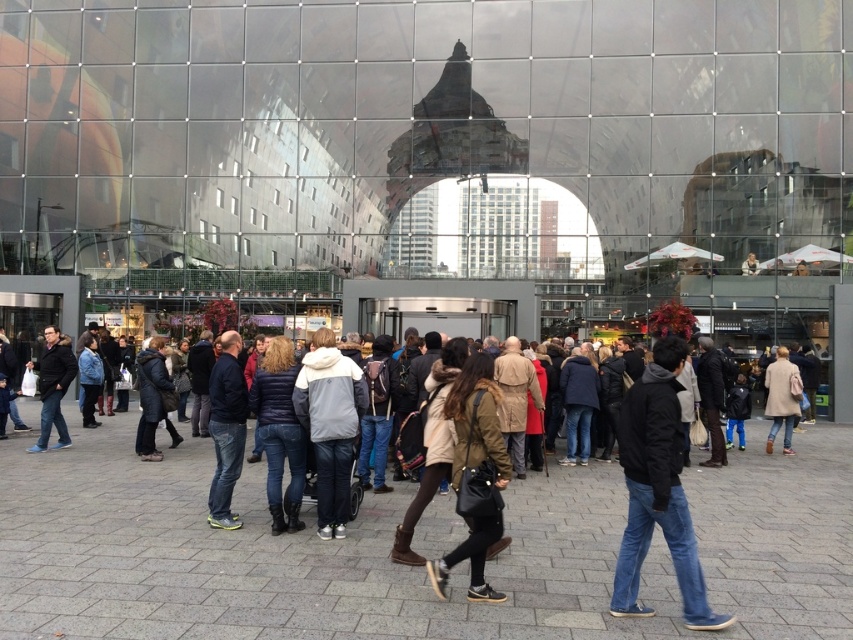
Which of these two, gray fleece jacket at center or beige wool coat at center, stands taller?

gray fleece jacket at center is taller.

Is gray fleece jacket at center smaller than beige wool coat at center?

Yes, gray fleece jacket at center is smaller than beige wool coat at center.

In order to click on gray fleece jacket at center in this screenshot , I will do `click(329, 424)`.

Image resolution: width=853 pixels, height=640 pixels. Find the location of `gray fleece jacket at center`. gray fleece jacket at center is located at coordinates (329, 424).

Image resolution: width=853 pixels, height=640 pixels. Describe the element at coordinates (405, 564) in the screenshot. I see `denim jacket at center` at that location.

Does denim jacket at center have a smaller size compared to dark blue quilted jacket at center?

Incorrect, denim jacket at center is not smaller in size than dark blue quilted jacket at center.

The image size is (853, 640). What are the coordinates of `denim jacket at center` in the screenshot? It's located at pos(405,564).

Can you confirm if brown leather jacket at center is positioned above dark blue jacket at center?

No, brown leather jacket at center is not above dark blue jacket at center.

Does brown leather jacket at center have a lesser width compared to dark blue jacket at center?

No, brown leather jacket at center is not thinner than dark blue jacket at center.

Between point (486, 451) and point (231, 525), which one is positioned behind?

Point (231, 525)

Where is `brown leather jacket at center`? Image resolution: width=853 pixels, height=640 pixels. brown leather jacket at center is located at coordinates (474, 474).